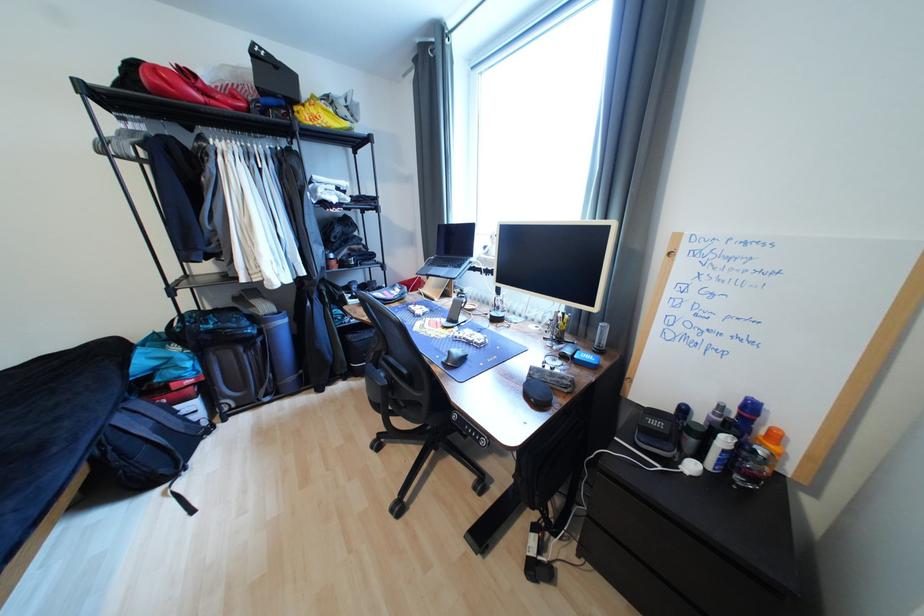
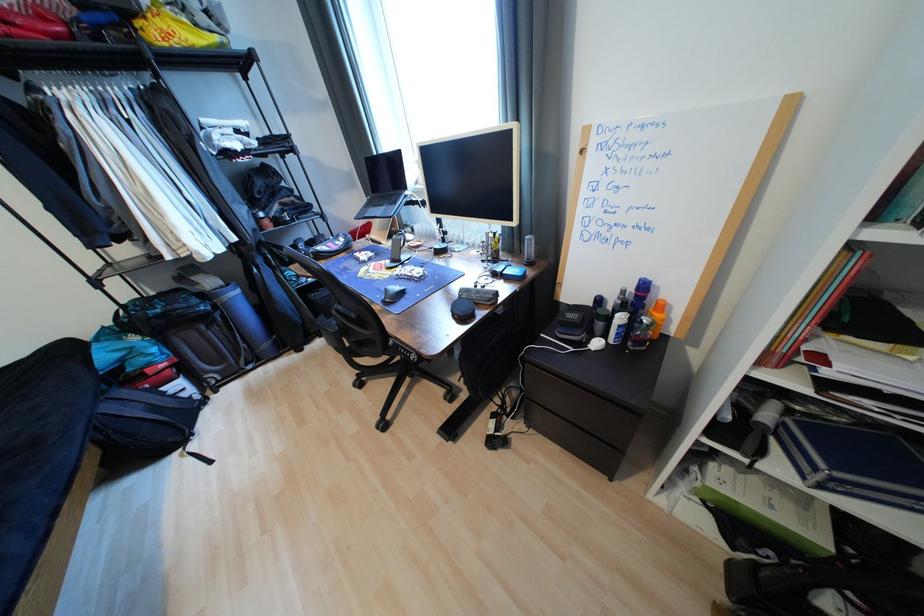
The point at (x=128, y=421) is marked in the first image. Where is the corresponding point in the second image?

(116, 408)